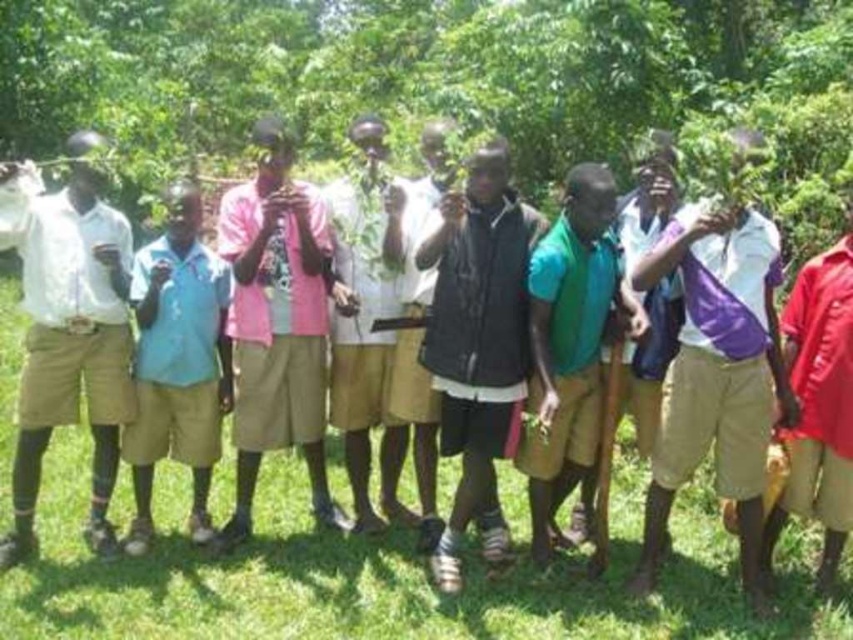
Question: Which of the following is the farthest from the observer?

Choices:
 (A) (115, 298)
 (B) (306, 276)
 (C) (338, 353)

Answer: (C)

Question: Is green leafy tree at center to the right of white cotton shirt at left from the viewer's perspective?

Choices:
 (A) yes
 (B) no

Answer: (A)

Question: Which point is farther to the camera?

Choices:
 (A) (460, 436)
 (B) (300, 417)
 (C) (372, 419)
 (D) (552, 122)

Answer: (D)

Question: Is black matte vest at center below green matte shirt at center?

Choices:
 (A) yes
 (B) no

Answer: (B)

Question: Which object appears farthest from the camera in this image?

Choices:
 (A) black matte vest at center
 (B) white cotton shirt at left
 (C) pink fabric shirt at center
 (D) pink cotton shirt at center

Answer: (D)

Question: Observing the image, what is the correct spatial positioning of black matte vest at center in reference to pink fabric shirt at center?

Choices:
 (A) below
 (B) above

Answer: (A)